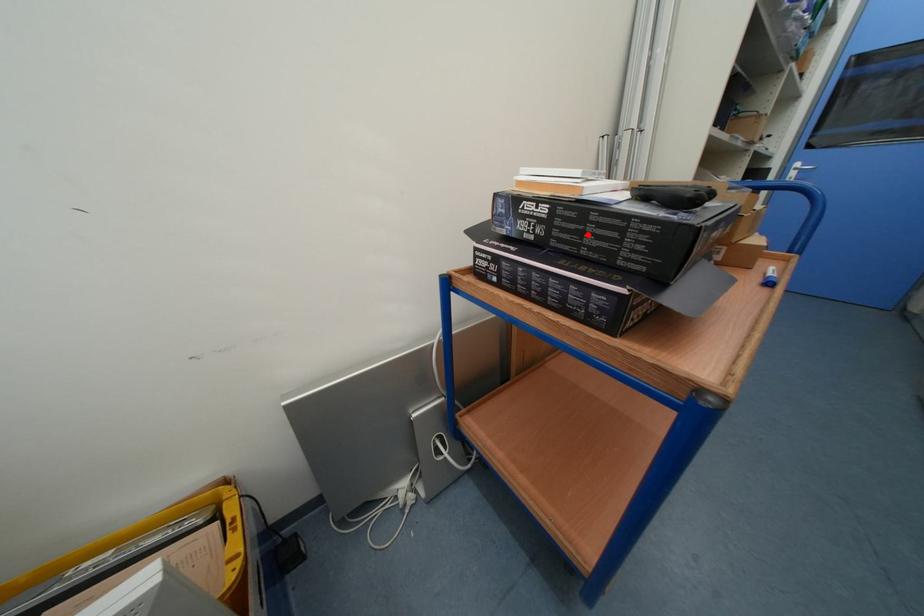
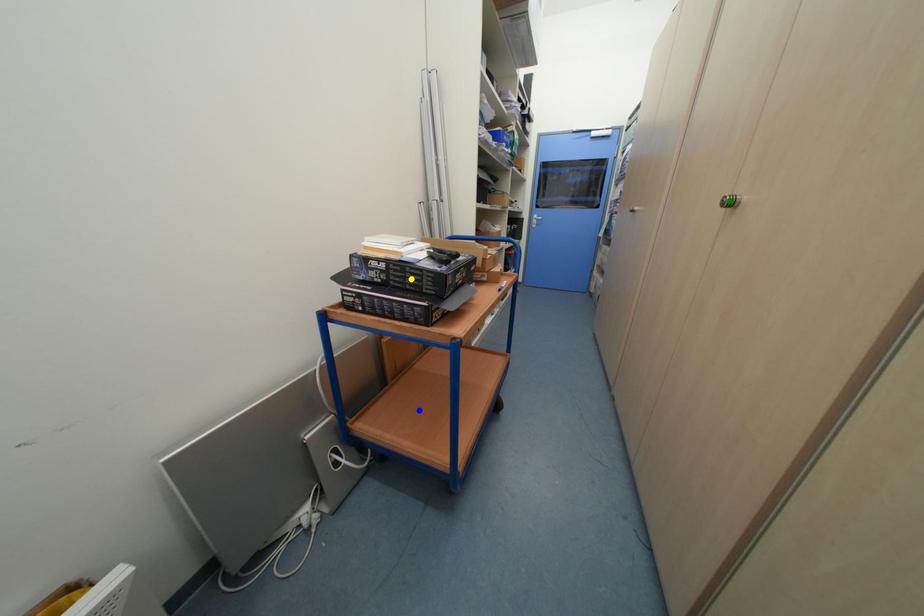
Question: I am providing you with two images of the same scene from different viewpoints. A red point is marked on the first image. You are given multiple points on the second image. In image 2, which mark is for the same physical point as the one in image 1?

Choices:
 (A) blue point
 (B) yellow point
 (C) green point

Answer: (B)